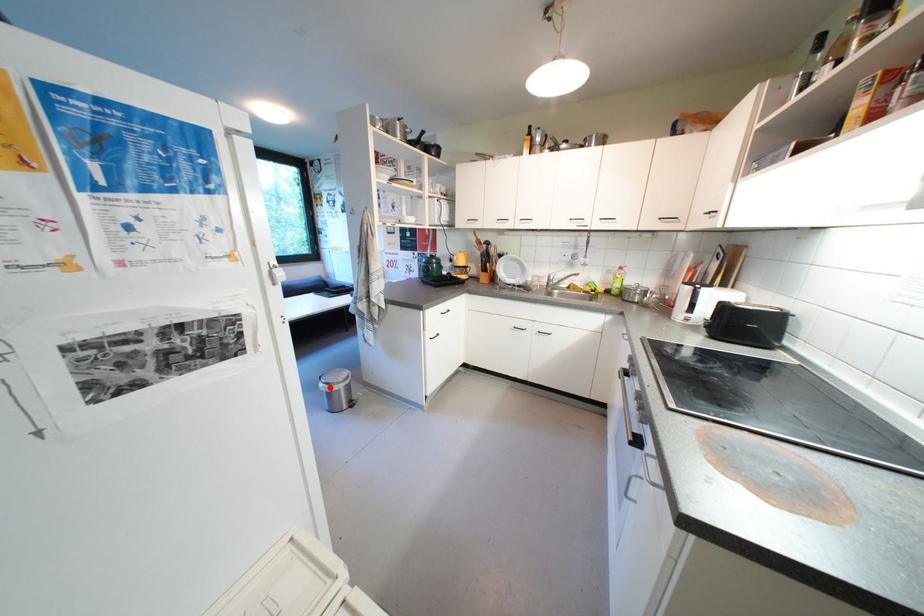
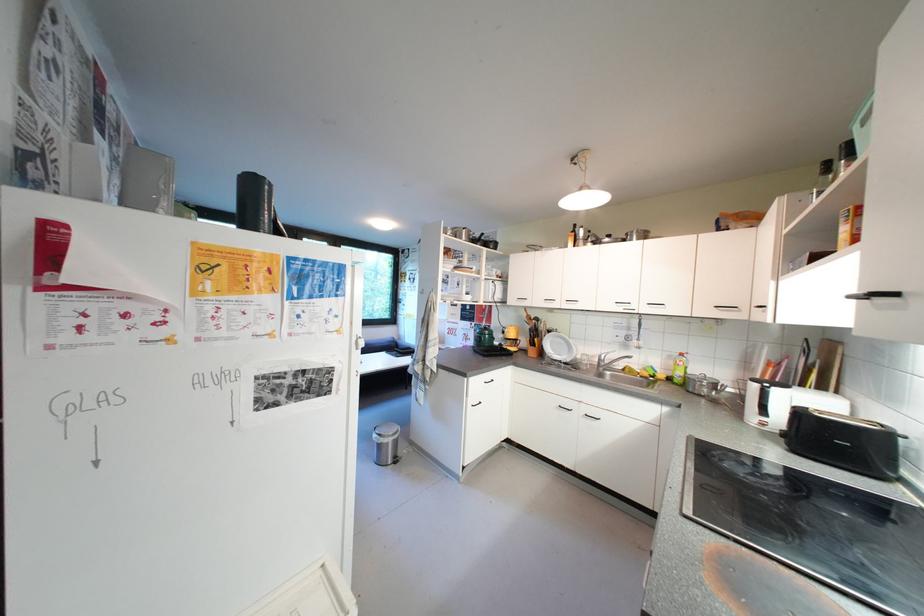
Question: A red point is marked in image1. In image2, is the corresponding 3D point closer to the camera or farther? Reply with the corresponding letter.

Choices:
 (A) The corresponding 3D point is closer.
 (B) The corresponding 3D point is farther.

Answer: (A)